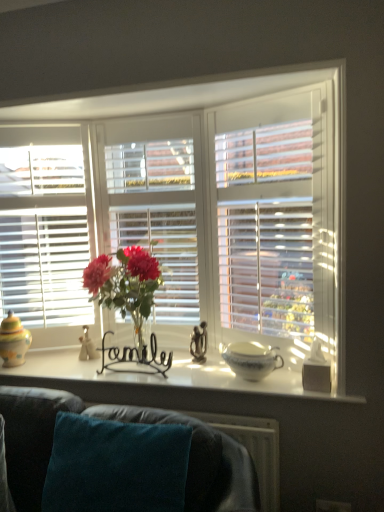
At what (x,y) coordinates should I click in order to perform the action: click on vacant region to the left of translucent glass vase at center. Please return your answer as a coordinate pair (x, y). Looking at the image, I should click on (73, 365).